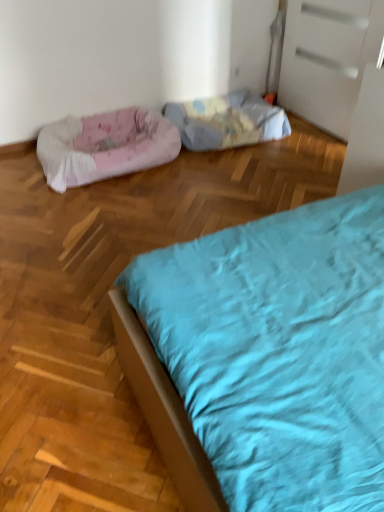
Question: Considering the positions of fluffy fabric dog bed at center, placed as the first dog bed when sorted from right to left, and pink fabric dog bed at left, the 2th dog bed from the right, in the image, is fluffy fabric dog bed at center, placed as the first dog bed when sorted from right to left, wider or thinner than pink fabric dog bed at left, the 2th dog bed from the right,?

Choices:
 (A) wide
 (B) thin

Answer: (B)

Question: Considering the positions of point (274, 110) and point (74, 179), is point (274, 110) closer or farther from the camera than point (74, 179)?

Choices:
 (A) farther
 (B) closer

Answer: (A)

Question: From a real-world perspective, relative to pink fabric dog bed at left, acting as the 1th dog bed starting from the left, is fluffy fabric dog bed at center, placed as the first dog bed when sorted from right to left, vertically above or below?

Choices:
 (A) above
 (B) below

Answer: (B)

Question: In terms of size, does pink fabric dog bed at left, the 2th dog bed from the right, appear bigger or smaller than fluffy fabric dog bed at center, placed as the first dog bed when sorted from right to left?

Choices:
 (A) big
 (B) small

Answer: (A)

Question: Is point (44, 154) closer or farther from the camera than point (253, 116)?

Choices:
 (A) closer
 (B) farther

Answer: (A)

Question: Is pink fabric dog bed at left, acting as the 1th dog bed starting from the left, inside the boundaries of fluffy fabric dog bed at center, placed as the first dog bed when sorted from right to left, or outside?

Choices:
 (A) outside
 (B) inside

Answer: (A)

Question: Considering the positions of pink fabric dog bed at left, acting as the 1th dog bed starting from the left, and fluffy fabric dog bed at center, which ranks as the 2th dog bed in left-to-right order, in the image, is pink fabric dog bed at left, acting as the 1th dog bed starting from the left, wider or thinner than fluffy fabric dog bed at center, which ranks as the 2th dog bed in left-to-right order,?

Choices:
 (A) thin
 (B) wide

Answer: (B)